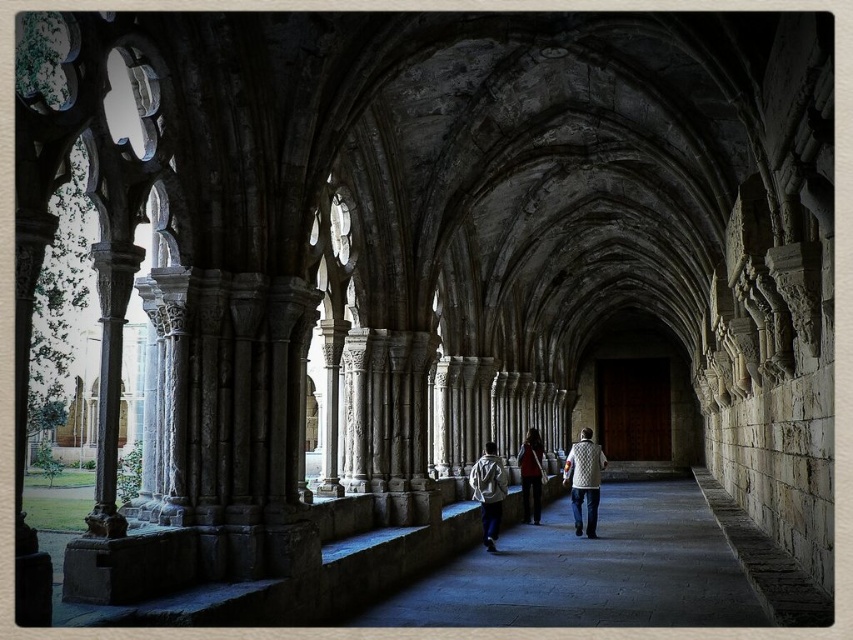
You are standing in the Gothic corridor and see two items hanging on a hook at the center. The items are the white knitted vest at center and the white fabric jacket at center. Which one is closer to the ground?

The white knitted vest at center is positioned under the white fabric jacket at center, so the white knitted vest at center is closer to the ground.

You are standing at the entrance of the Gothic corridor and see a dark stone path at center and a white knitted vest at center. Which object is nearer to you?

The dark stone path at center is closer to the viewer than the white knitted vest at center.